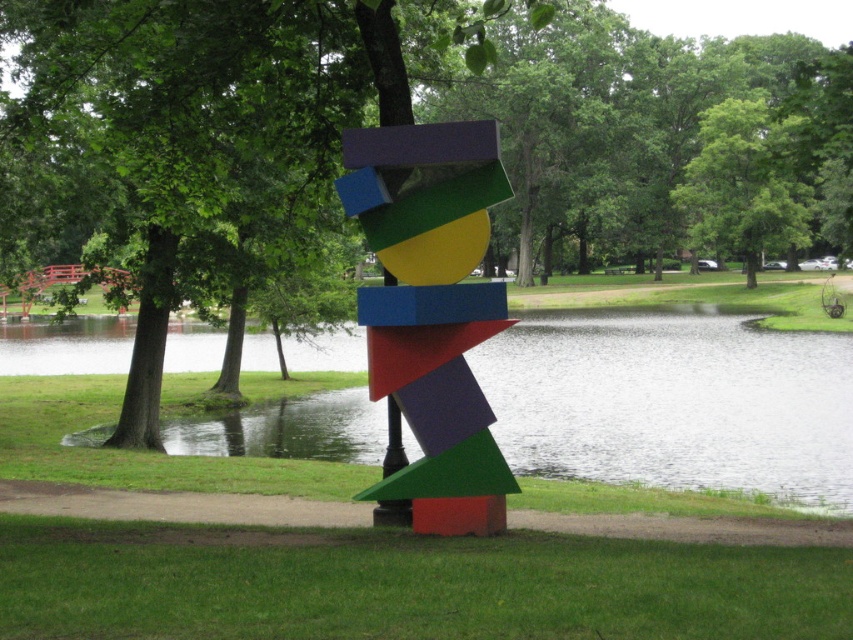
Looking at this image, you are standing in the park and want to take a photo of the transparent glass water at center and the green leafy tree at upper center. Which object should you focus on first to ensure both are in the frame?

You should focus on the transparent glass water at center first since it is in front of the green leafy tree at upper center, so positioning the camera to include both would require ensuring the foreground object is properly framed.

You are a visitor in the park and want to take a photo of the green matte tree at center and the green leafy tree at upper center. Which tree should you stand closer to in order to capture both in a single frame?

You should stand closer to the green leafy tree at upper center because it is shorter than the green matte tree at center, allowing both to fit within the camera frame when positioned appropriately.